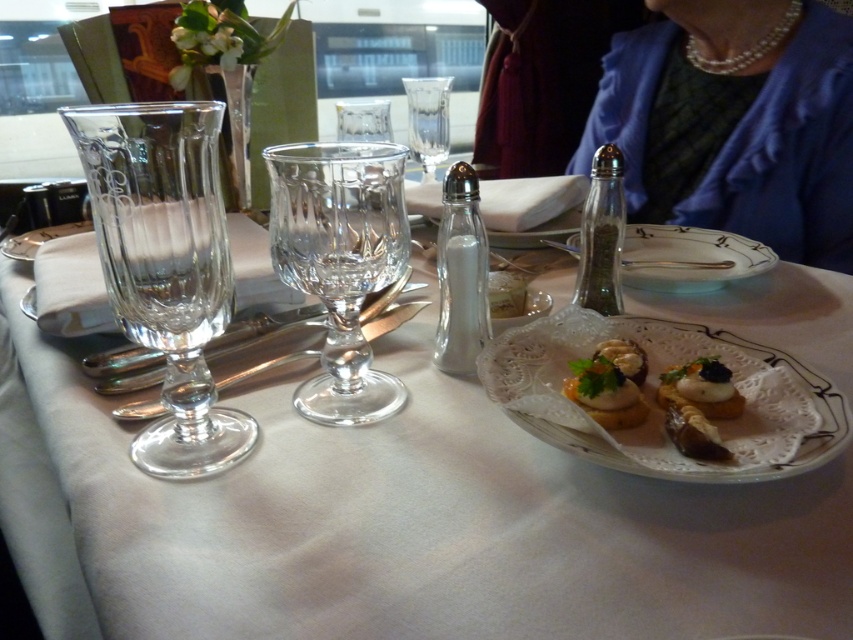
You are a server at a restaurant and need to place a dessert plate between the clear glass wine glass at center and the transparent crystal wine glass at center. Which glass should you move to make space?

The clear glass wine glass at center is taller than the transparent crystal wine glass at center, so you should move the transparent crystal wine glass at center to make space for the dessert plate.

You are a customer sitting at the dining table and want to reach both points. Which point, point (158, 333) or point (631, 381), is closer to you?

Point (158, 333) is closer to the viewer than point (631, 381), so you can reach it first.